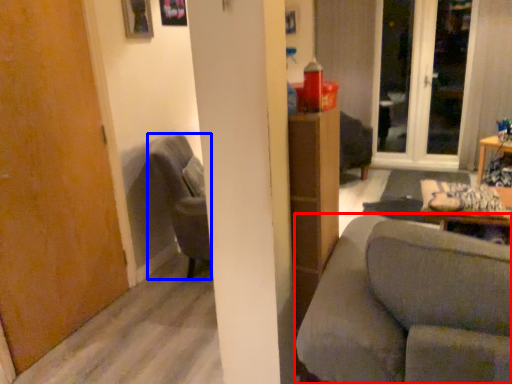
Question: Which point is further to the camera, studio couch (highlighted by a red box) or chair (highlighted by a blue box)?

Choices:
 (A) studio couch
 (B) chair

Answer: (B)